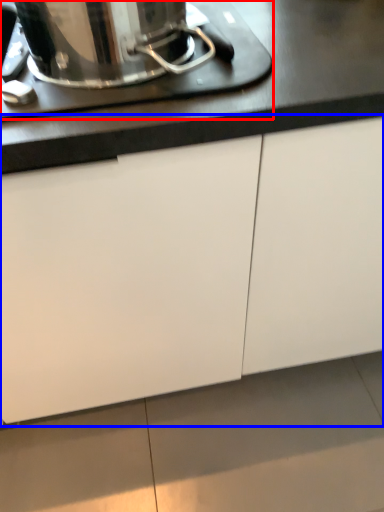
Question: Which object is further to the camera taking this photo, home appliance (highlighted by a red box) or cabinetry (highlighted by a blue box)?

Choices:
 (A) home appliance
 (B) cabinetry

Answer: (A)